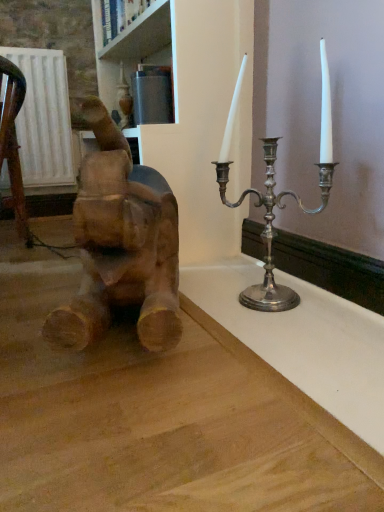
Question: Can you confirm if white painted wood at upper center is bigger than wooden elephant at left?

Choices:
 (A) no
 (B) yes

Answer: (A)

Question: Is white painted wood at upper center at the right side of wooden elephant at left?

Choices:
 (A) no
 (B) yes

Answer: (A)

Question: Is white painted wood at upper center far away from wooden elephant at left?

Choices:
 (A) no
 (B) yes

Answer: (B)

Question: Is white painted wood at upper center positioned before wooden elephant at left?

Choices:
 (A) yes
 (B) no

Answer: (B)

Question: Is white painted wood at upper center next to wooden elephant at left and touching it?

Choices:
 (A) yes
 (B) no

Answer: (B)

Question: Is wooden elephant at left at the back of white painted wood at upper center?

Choices:
 (A) yes
 (B) no

Answer: (B)

Question: Is wooden elephant at left directly adjacent to white painted wood at upper center?

Choices:
 (A) no
 (B) yes

Answer: (A)

Question: Is wooden elephant at left far from white painted wood at upper center?

Choices:
 (A) no
 (B) yes

Answer: (B)

Question: From the image's perspective, is wooden elephant at left on white painted wood at upper center?

Choices:
 (A) no
 (B) yes

Answer: (A)

Question: Is wooden elephant at left not within white painted wood at upper center?

Choices:
 (A) yes
 (B) no

Answer: (A)

Question: Does wooden elephant at left have a larger size compared to white painted wood at upper center?

Choices:
 (A) no
 (B) yes

Answer: (B)

Question: From a real-world perspective, is wooden elephant at left under white painted wood at upper center?

Choices:
 (A) no
 (B) yes

Answer: (B)

Question: From a real-world perspective, relative to white painted wood at upper center, is wooden elephant at left vertically above or below?

Choices:
 (A) below
 (B) above

Answer: (A)